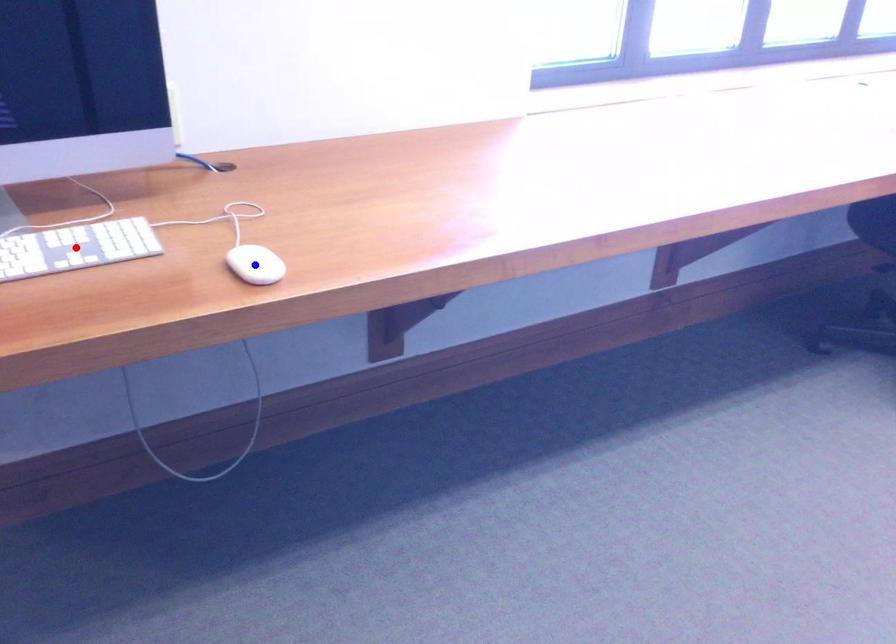
Question: In the image, two points are highlighted. Which point is nearer to the camera? Reply with the corresponding letter.

Choices:
 (A) blue point
 (B) red point

Answer: (A)